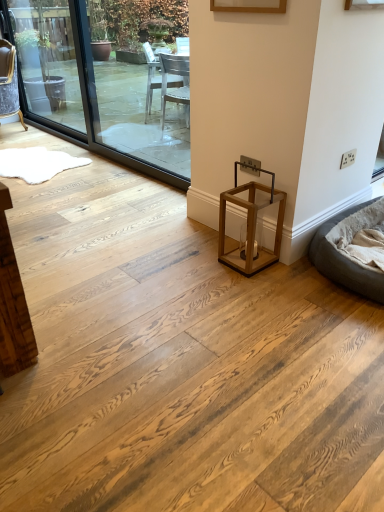
Question: Is velvet grey chair at left surrounding transparent glass window at left, which appears as the 1th window screen when viewed from the right?

Choices:
 (A) no
 (B) yes

Answer: (A)

Question: Is velvet grey chair at left further to camera compared to transparent glass window at left, which ranks as the second window screen in left-to-right order?

Choices:
 (A) no
 (B) yes

Answer: (B)

Question: Could you tell me if velvet grey chair at left is facing transparent glass window at left, which ranks as the second window screen in left-to-right order?

Choices:
 (A) yes
 (B) no

Answer: (B)

Question: Can you confirm if velvet grey chair at left is smaller than transparent glass window at left, which ranks as the second window screen in left-to-right order?

Choices:
 (A) no
 (B) yes

Answer: (A)

Question: Is velvet grey chair at left far away from transparent glass window at left, which ranks as the second window screen in left-to-right order?

Choices:
 (A) yes
 (B) no

Answer: (A)

Question: Considering the positions of gray fabric bean bag at lower right and velvet grey chair at left in the image, is gray fabric bean bag at lower right wider or thinner than velvet grey chair at left?

Choices:
 (A) thin
 (B) wide

Answer: (B)

Question: Relative to velvet grey chair at left, is gray fabric bean bag at lower right in front or behind?

Choices:
 (A) front
 (B) behind

Answer: (A)

Question: From a real-world perspective, is gray fabric bean bag at lower right physically located above or below velvet grey chair at left?

Choices:
 (A) below
 (B) above

Answer: (A)

Question: From the image's perspective, is gray fabric bean bag at lower right located above or below velvet grey chair at left?

Choices:
 (A) below
 (B) above

Answer: (A)

Question: From a real-world perspective, relative to transparent glass window at upper left, the first window screen positioned from the left, is velvet grey chair at left vertically above or below?

Choices:
 (A) above
 (B) below

Answer: (B)

Question: From the image's perspective, is velvet grey chair at left above or below transparent glass window at upper left, the first window screen positioned from the left?

Choices:
 (A) below
 (B) above

Answer: (A)

Question: Is velvet grey chair at left wider or thinner than transparent glass window at upper left, the first window screen positioned from the left?

Choices:
 (A) wide
 (B) thin

Answer: (A)

Question: From their relative heights in the image, would you say velvet grey chair at left is taller or shorter than transparent glass window at upper left, arranged as the second window screen when viewed from the right?

Choices:
 (A) short
 (B) tall

Answer: (A)

Question: From a real-world perspective, is transparent glass window at upper left, the first window screen positioned from the left, physically located above or below gray fabric bean bag at lower right?

Choices:
 (A) above
 (B) below

Answer: (A)

Question: Relative to gray fabric bean bag at lower right, is transparent glass window at upper left, arranged as the second window screen when viewed from the right, in front or behind?

Choices:
 (A) behind
 (B) front

Answer: (A)